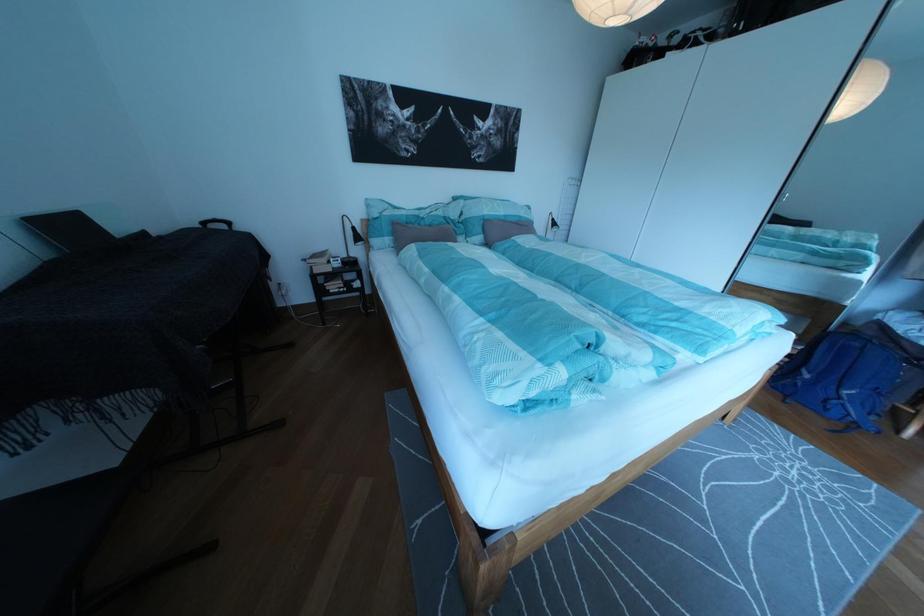
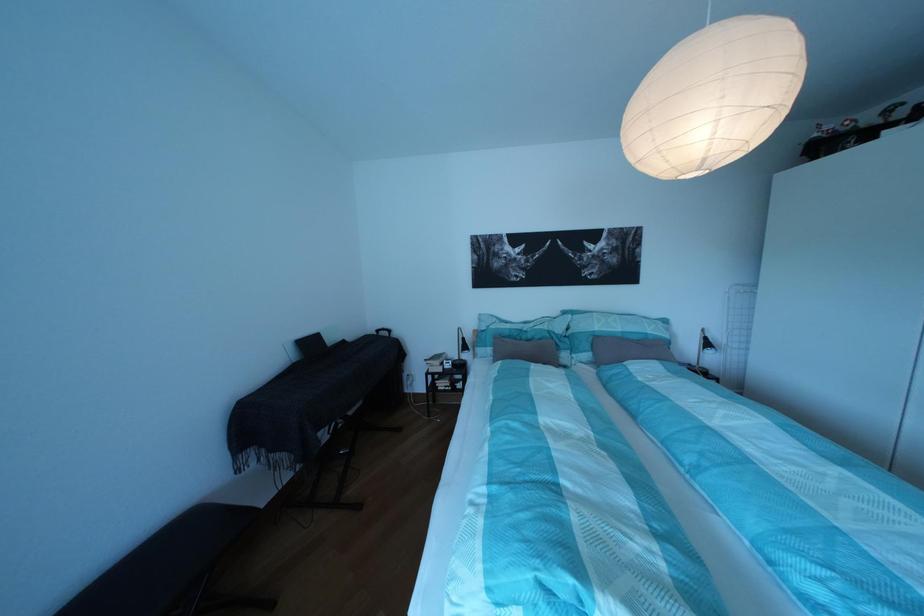
Locate, in the second image, the point that corresponds to [318,265] in the first image.

(439, 367)